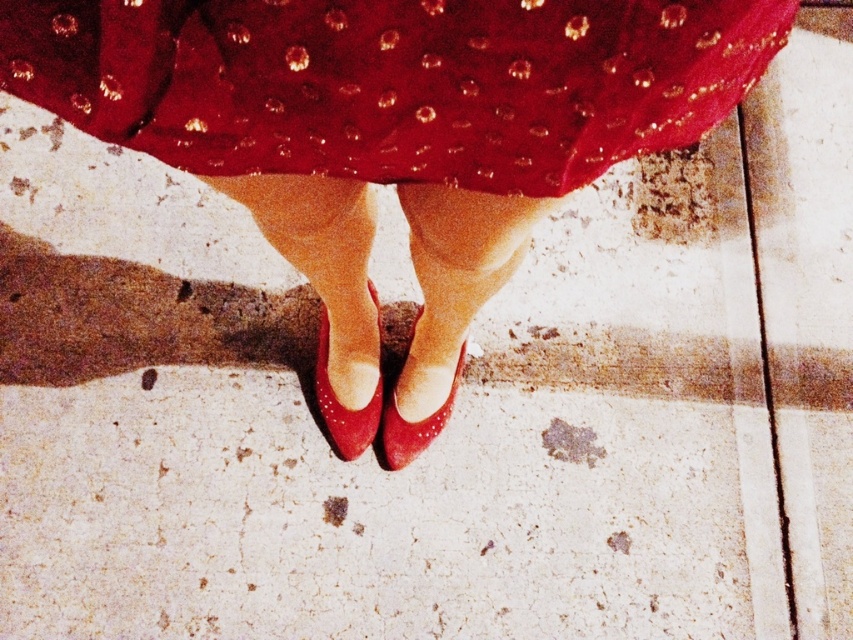
You are a fashion designer observing the image. You need to determine which item, the shiny patent leather shoes at center or the shiny red fabric at center, extends higher upwards. Which one is taller?

The shiny patent leather shoes at center is taller than the shiny red fabric at center.

You are a fashion designer examining the image. You need to determine which item is shorter between the shiny red fabric at center and the shiny leather sandal at center. Which one is shorter?

The shiny red fabric at center is shorter than the shiny leather sandal at center.

You are standing in front of the image and want to know how far the point at coordinates point [62,42] is from your eyes. Can you determine the distance?

The point at coordinates point [62,42] is 46.69 centimeters away from the camera, so it is approximately 46.69 centimeters from your eyes if you are looking directly at the image.